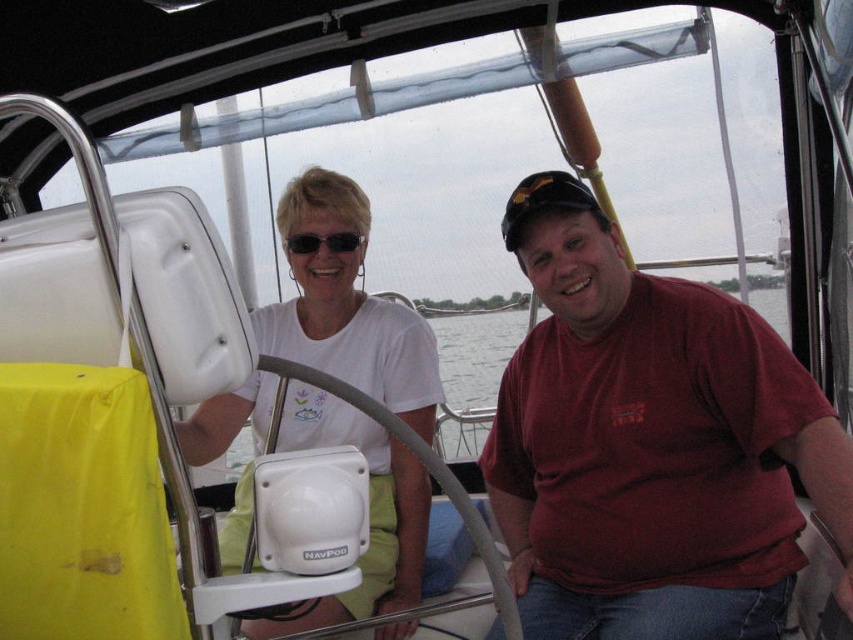
Is white matte steering wheel at center shorter than matte black sunglasses at upper center?

No.

Who is positioned more to the left, white matte steering wheel at center or matte black sunglasses at upper center?

white matte steering wheel at center

Who is more distant from viewer, (288, 410) or (300, 232)?

Positioned behind is point (288, 410).

You are a GUI agent. You are given a task and a screenshot of the screen. Output one action in this format:
    pyautogui.click(x=<x>, y=<y>)
    Task: Click on the white matte steering wheel at center
    This screenshot has height=640, width=853.
    Given the screenshot: What is the action you would take?
    pyautogui.click(x=347, y=308)

Is red matte shirt at center wider than matte black sunglasses at upper center?

Yes, red matte shirt at center is wider than matte black sunglasses at upper center.

In the scene shown: Can you confirm if red matte shirt at center is taller than matte black sunglasses at upper center?

Yes, red matte shirt at center is taller than matte black sunglasses at upper center.

Find the location of a particular element. The height and width of the screenshot is (640, 853). red matte shirt at center is located at coordinates (650, 444).

Who is positioned more to the left, red matte shirt at center or white matte steering wheel at center?

Positioned to the left is white matte steering wheel at center.

Is point (582, 452) closer to viewer compared to point (374, 584)?

Yes.

At what (x,y) coordinates should I click in order to perform the action: click on red matte shirt at center. Please return your answer as a coordinate pair (x, y). Looking at the image, I should click on (650, 444).